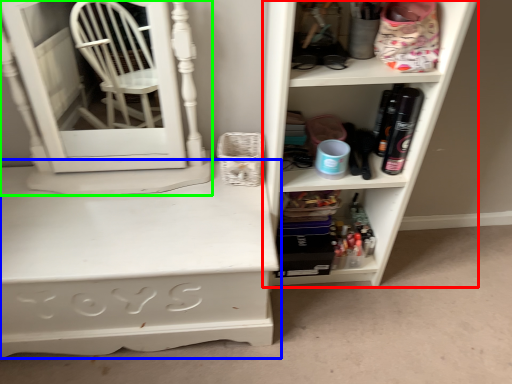
Question: Which object is positioned closest to shelf (highlighted by a red box)? Select from desk (highlighted by a blue box) and medicine cabinet (highlighted by a green box).

Choices:
 (A) desk
 (B) medicine cabinet

Answer: (A)